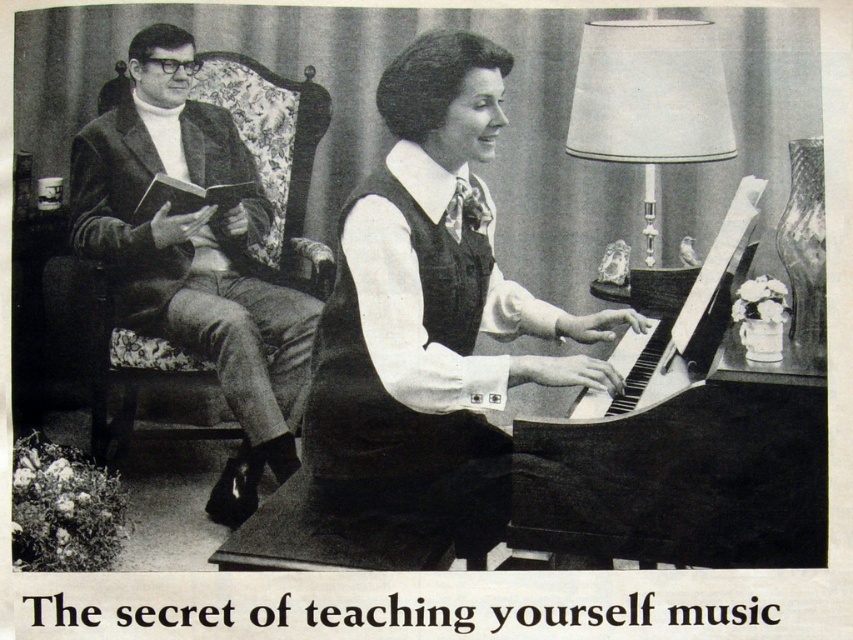
In the black and white photo, there is a matte black jacket at left and a metallic silver lampshade at upper right. Which object takes up more space in the image?

The matte black jacket at left takes up more space in the image because it has a larger size compared to the metallic silver lampshade at upper right.

You are trying to decide which piano to place in your living room. The matte black piano at center and the black polished piano at center are options. Based on the image, which one has a larger width?

The matte black piano at center is wider than the black polished piano at center according to the description.

You are a photographer standing in the living room scene. You want to take a photo of both the matte black jacket at left and the metallic silver lampshade at upper right in the same frame. Which object should you focus on first to ensure both are in focus?

You should focus on the matte black jacket at left first because it is closer to you than the metallic silver lampshade at upper right, so focusing on the closer object ensures both are in focus.